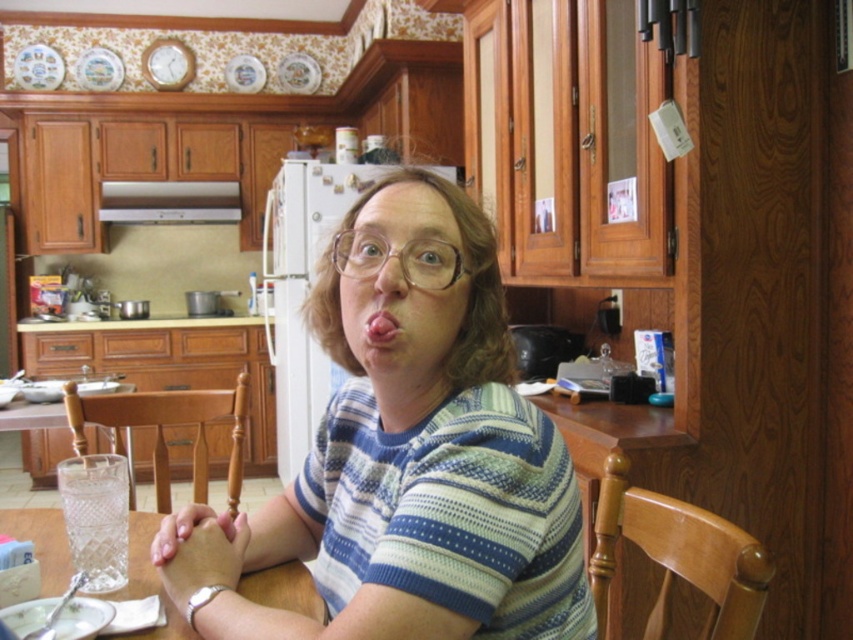
The width and height of the screenshot is (853, 640). What do you see at coordinates (405, 458) in the screenshot?
I see `striped cotton shirt at center` at bounding box center [405, 458].

What do you see at coordinates (405, 458) in the screenshot?
I see `striped cotton shirt at center` at bounding box center [405, 458].

This screenshot has height=640, width=853. Find the location of `striped cotton shirt at center`. striped cotton shirt at center is located at coordinates [405, 458].

Does clear glass table at center have a lesser height compared to pink flesh at center?

Yes.

Find the location of a particular element. The height and width of the screenshot is (640, 853). clear glass table at center is located at coordinates (148, 580).

Locate an element on the screen. clear glass table at center is located at coordinates (148, 580).

Is striped cotton shirt at center to the left of clear glass table at center from the viewer's perspective?

In fact, striped cotton shirt at center is to the right of clear glass table at center.

Between point (540, 460) and point (45, 550), which one is positioned behind?

Point (45, 550)

This screenshot has width=853, height=640. I want to click on striped cotton shirt at center, so click(405, 458).